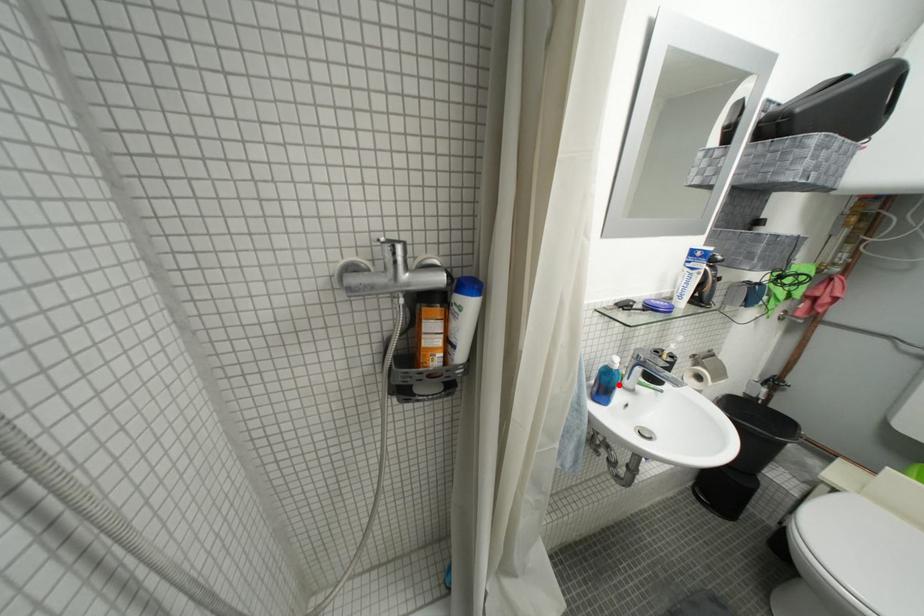
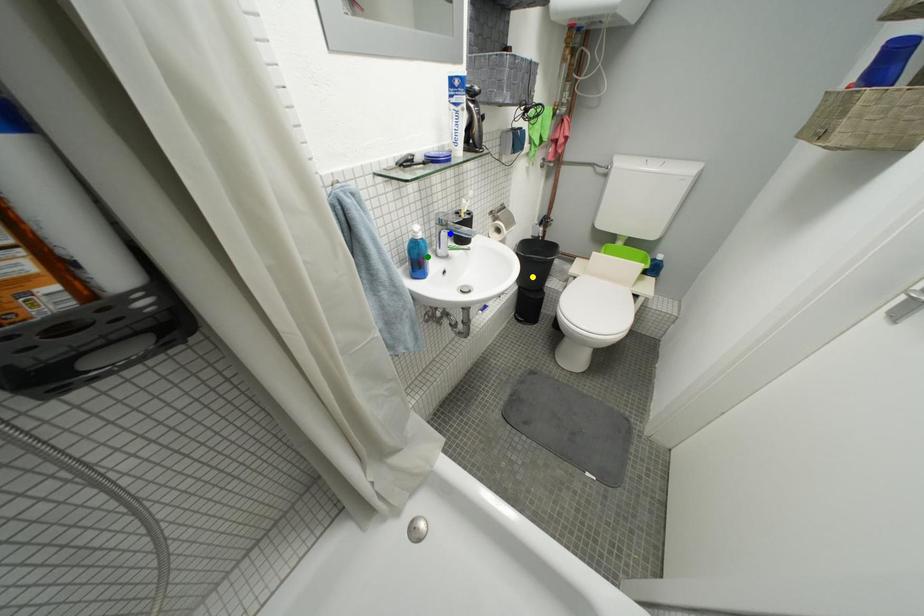
Question: I am providing you with two images of the same scene from different viewpoints. A red point is marked on the first image. You are given multiple points on the second image. In image 2, which mark is for the same physical point as the one in image 1?

Choices:
 (A) blue point
 (B) yellow point
 (C) green point

Answer: (C)